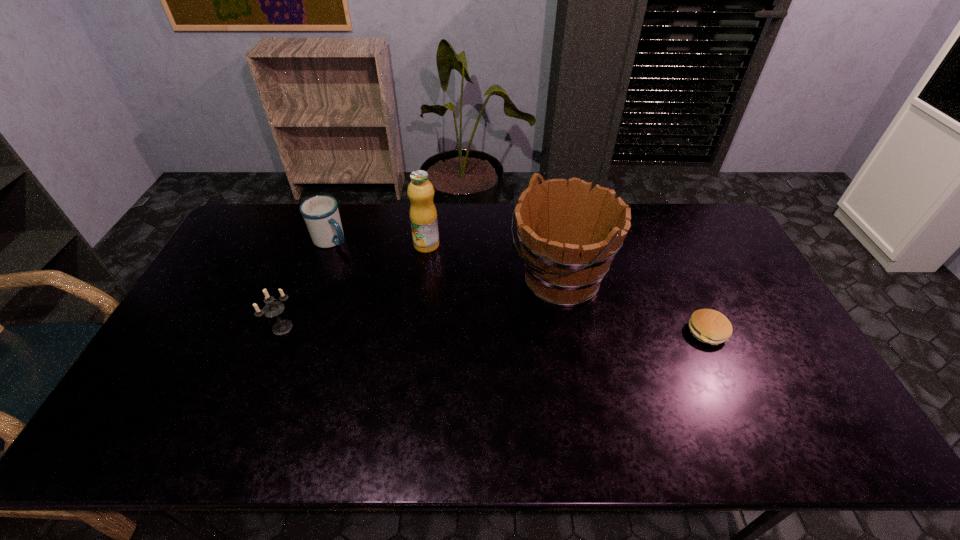
The width and height of the screenshot is (960, 540). Find the location of `vacant spot on the desktop that is between the candle holder and the patty and is positioned on the front label of the fruit juice`. vacant spot on the desktop that is between the candle holder and the patty and is positioned on the front label of the fruit juice is located at coordinates (433, 329).

At what (x,y) coordinates should I click in order to perform the action: click on free spot on the desktop that is between the candle holder and the patty and is positioned with the handle on the second object from right to left. Please return your answer as a coordinate pair (x, y). The image size is (960, 540). Looking at the image, I should click on click(x=468, y=329).

Identify the location of free space on the desktop that is between the candle holder and the patty and is positioned on the handle side of the mug. (466, 329).